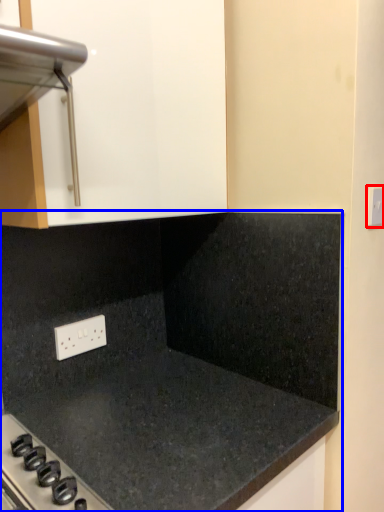
Question: Which point is closer to the camera, electric outlet (highlighted by a red box) or countertop (highlighted by a blue box)?

Choices:
 (A) electric outlet
 (B) countertop

Answer: (B)